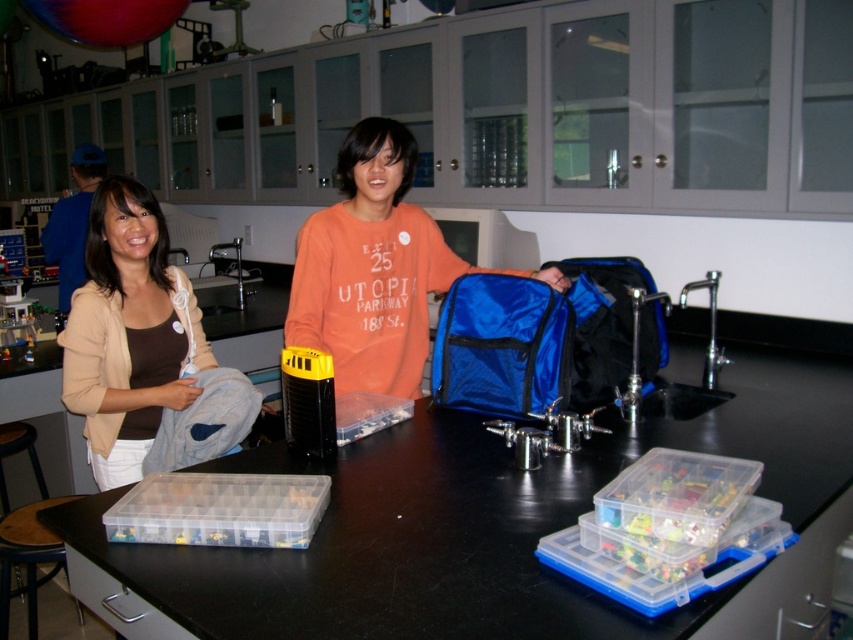
You are a delivery person who needs to place a 1.2 meter long package on the clear plastic table at center. Can you fit the package on the table without it hanging over the edges?

The clear plastic table at center and viewer are 1.04 meters apart from each other. Since the package is 1.2 meters long, it cannot be placed on the table without hanging over the edges as the table is shorter than the package.